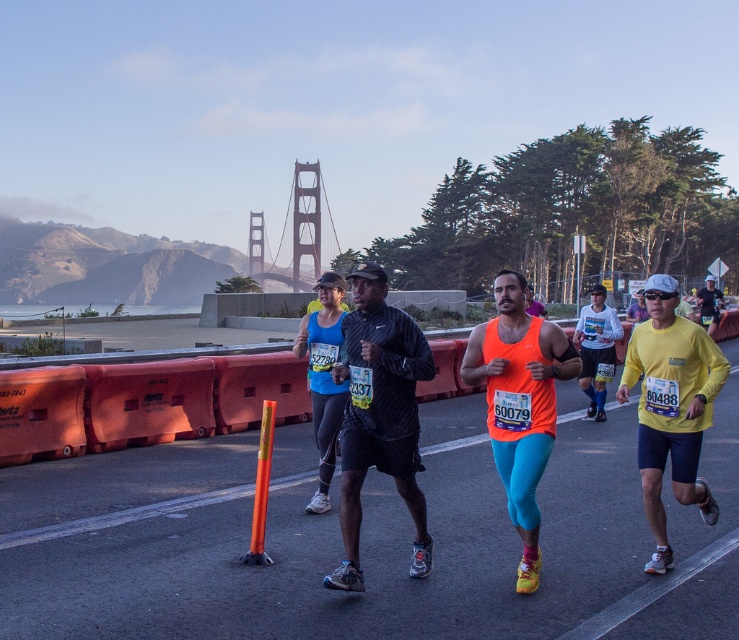
You are a photographer positioned at the center of the bridge, aiming to capture the yellow fabric shirt at right in your shot. Based on its 2D coordinates, where should you point your camera relative to your current position?

The yellow fabric shirt at right is located at 2D coordinates point (670, 406). This means it is positioned to the right and slightly above the center of the frame, so you should aim your camera to the right and upwards to capture it.